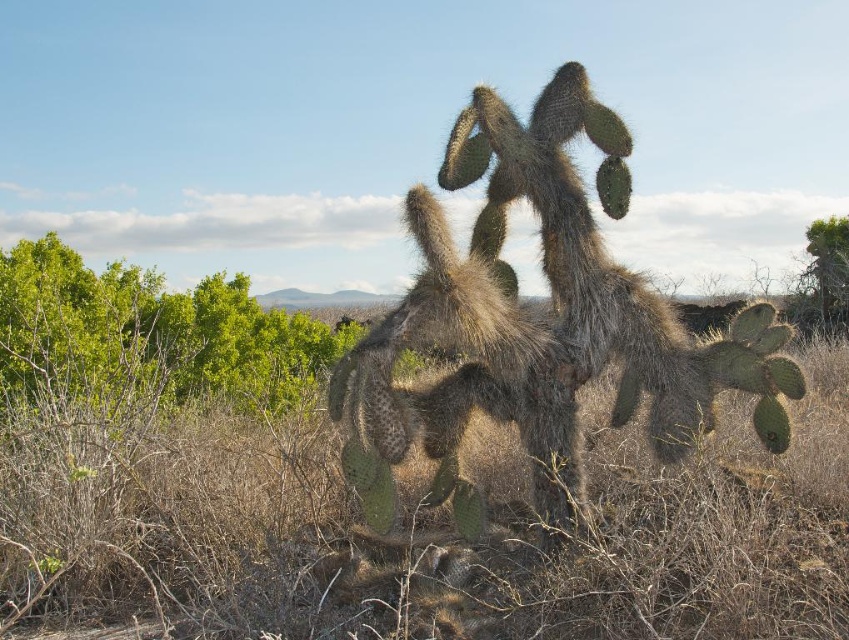
You are a desert explorer who needs to identify vegetation sizes. Which object has a smaller size between the brown dry grass at center and the green leafy shrubs at left?

The brown dry grass at center has a smaller size compared to the green leafy shrubs at left.

Consider the image. You are a desert explorer who wants to take a photo of the spiky green cactus at center. You notice brown dry grass at center in the foreground. Will the grass block your view of the cactus?

The brown dry grass at center is located below the spiky green cactus at center, so it will not block your view of the cactus as it is positioned lower.